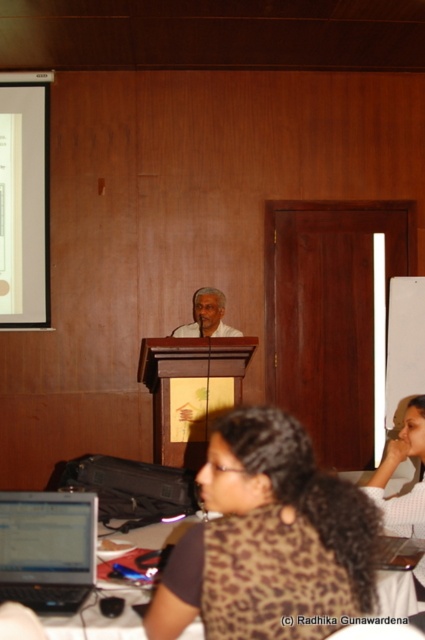
Question: Does brown leopard print shirt at lower center have a larger size compared to white matte speaker at center?

Choices:
 (A) no
 (B) yes

Answer: (B)

Question: Which point appears closest to the camera in this image?

Choices:
 (A) (11, 176)
 (B) (244, 614)

Answer: (B)

Question: Can you confirm if brown leopard print shirt at lower center is smaller than white matte projection screen at upper left?

Choices:
 (A) no
 (B) yes

Answer: (A)

Question: Which object is the farthest from the silver metallic laptop at lower left?

Choices:
 (A) white matte speaker at center
 (B) brown leopard print shirt at lower right
 (C) white matte projection screen at upper left
 (D) brown leopard print shirt at lower center

Answer: (C)

Question: Does silver metallic laptop at lower left have a smaller size compared to brown leopard print shirt at lower right?

Choices:
 (A) yes
 (B) no

Answer: (A)

Question: Which point appears closest to the camera in this image?

Choices:
 (A) (197, 301)
 (B) (393, 458)
 (C) (243, 618)

Answer: (C)